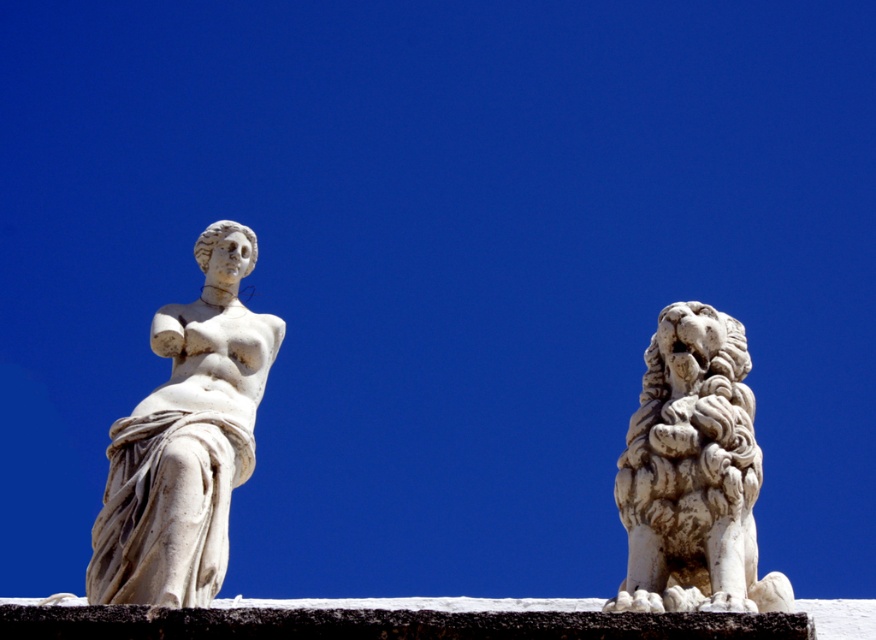
Question: Can you confirm if white marble statue at left is positioned to the right of white stone lion at right?

Choices:
 (A) no
 (B) yes

Answer: (A)

Question: Which of the following is the closest to the observer?

Choices:
 (A) (220, 516)
 (B) (738, 458)

Answer: (A)

Question: Which object is closer to the camera taking this photo?

Choices:
 (A) white marble statue at left
 (B) white stone lion at right

Answer: (B)

Question: Which object appears farthest from the camera in this image?

Choices:
 (A) white marble statue at left
 (B) white stone lion at right

Answer: (A)

Question: Does white marble statue at left have a greater width compared to white stone lion at right?

Choices:
 (A) no
 (B) yes

Answer: (A)

Question: Is white marble statue at left to the right of white stone lion at right from the viewer's perspective?

Choices:
 (A) no
 (B) yes

Answer: (A)